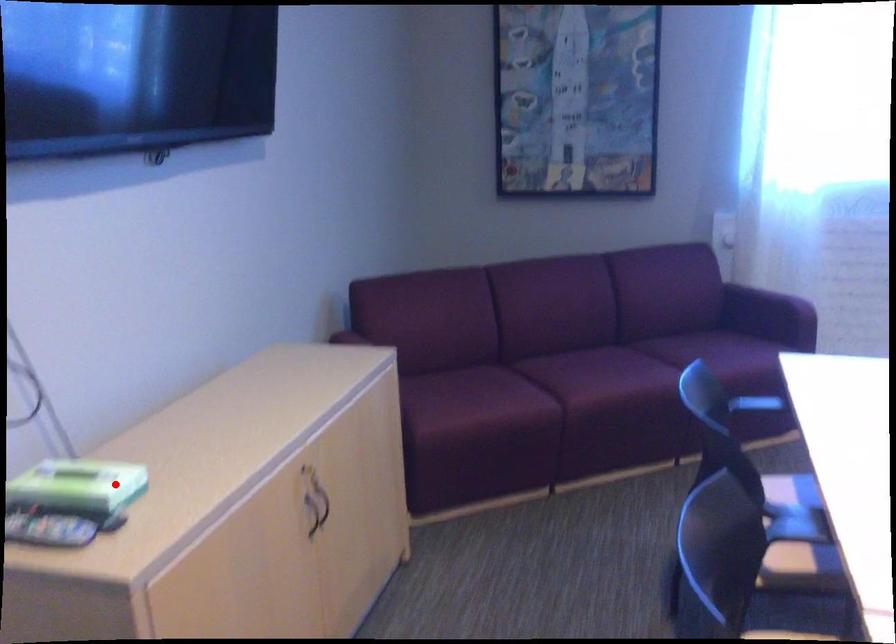
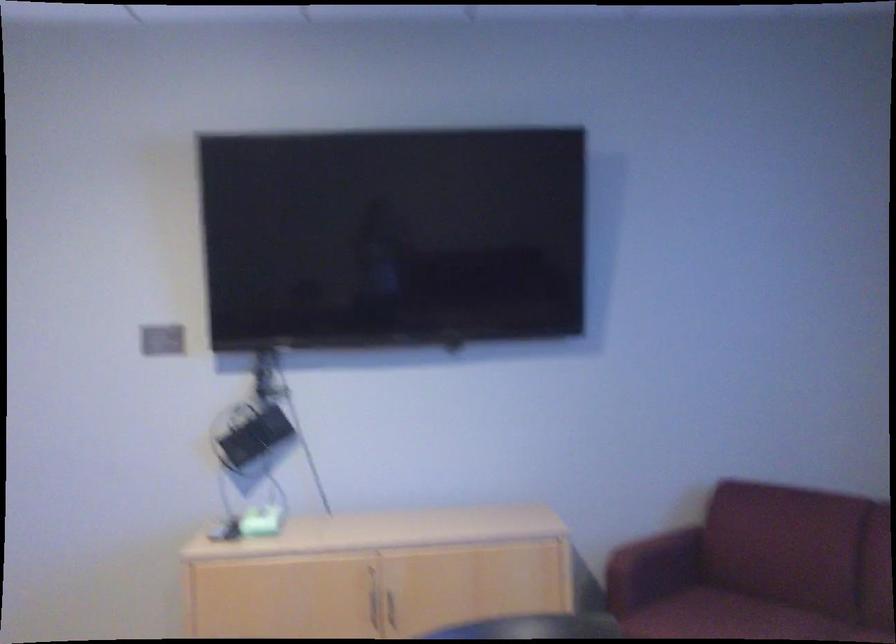
Question: I am providing you with two images of the same scene from different viewpoints. In image1, a red point is highlighted. Considering the same 3D point in image2, which of the following is correct?

Choices:
 (A) It is closer
 (B) It is farther

Answer: (B)